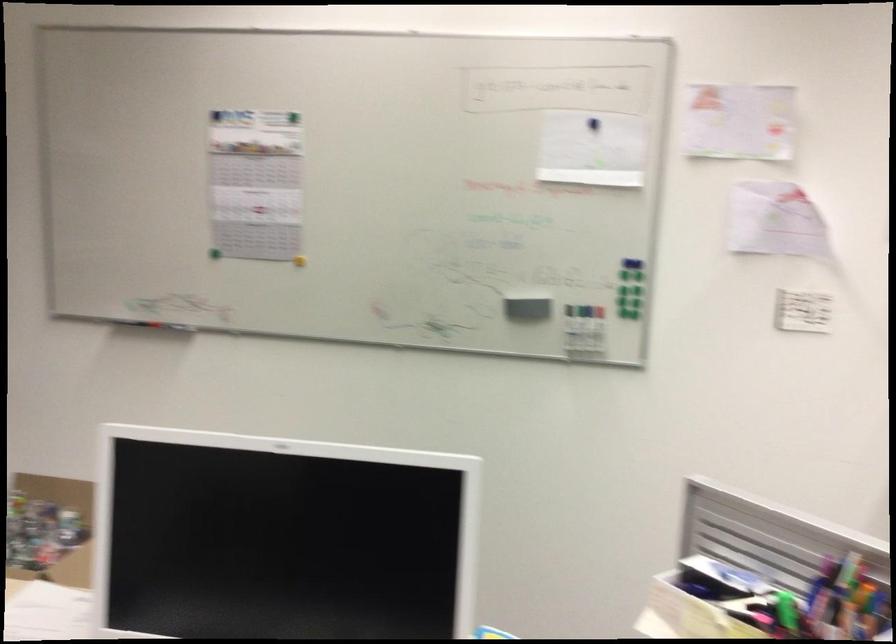
Locate an element on the screen. The image size is (896, 644). blue whiteboard marker is located at coordinates (587, 332).